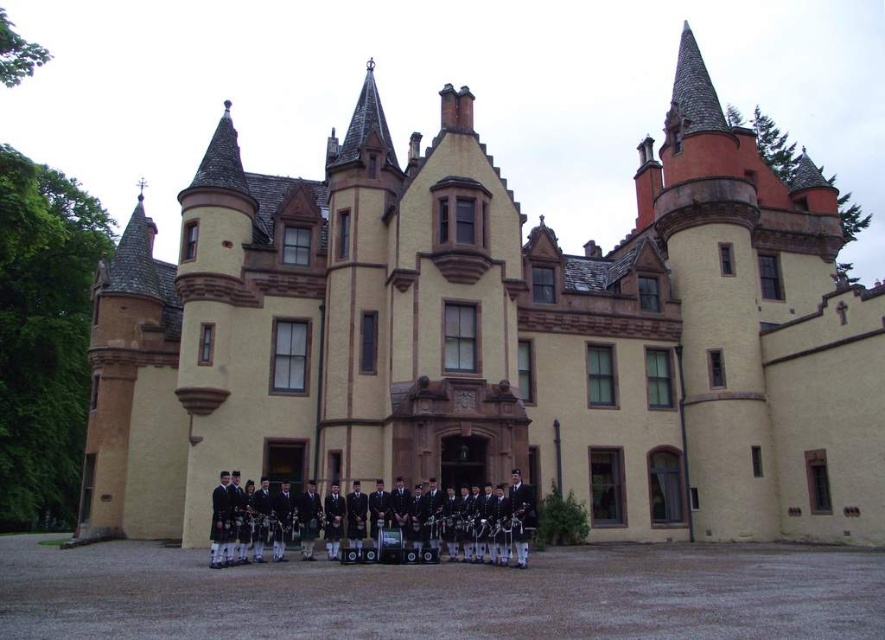
Who is taller, black wool kilt at center or dark blue wool kilt at center?

black wool kilt at center is taller.

Who is higher up, black wool kilt at center or dark blue wool kilt at center?

Positioned higher is dark blue wool kilt at center.

Does point (468, 516) come closer to viewer compared to point (335, 513)?

Yes, it is.

Identify the location of black wool kilt at center. (431, 524).